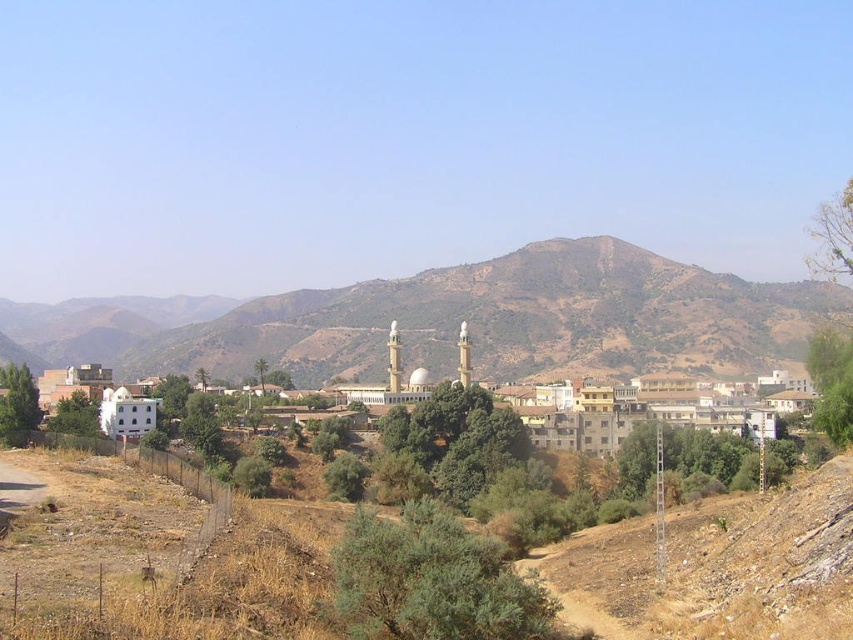
Question: Can you confirm if brown dirt track at lower center is thinner than brown rocky mountain at center?

Choices:
 (A) no
 (B) yes

Answer: (B)

Question: Which point appears closest to the camera in this image?

Choices:
 (A) (691, 392)
 (B) (442, 291)
 (C) (103, 496)

Answer: (C)

Question: Is brown dirt track at lower center closer to the viewer compared to brown rocky mountain at center?

Choices:
 (A) yes
 (B) no

Answer: (A)

Question: Is brown dirt track at lower center positioned in front of brown rocky mountain at center?

Choices:
 (A) no
 (B) yes

Answer: (B)

Question: Which point appears closest to the camera in this image?

Choices:
 (A) (672, 260)
 (B) (611, 410)
 (C) (637, 616)

Answer: (C)

Question: Estimate the real-world distances between objects in this image. Which object is farther from the white matte building at center?

Choices:
 (A) brown dirt track at lower center
 (B) brown rocky mountain at center

Answer: (B)